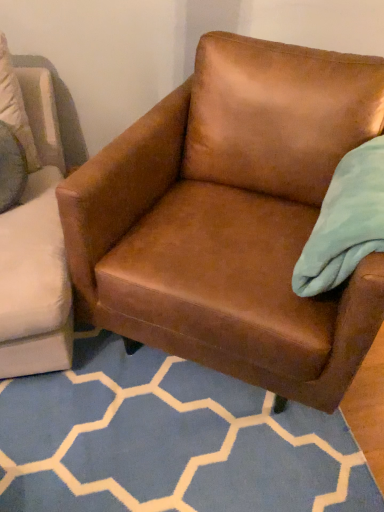
Question: Would you say brown leather chair at center is to the left or to the right of brown leather armchair at center in the picture?

Choices:
 (A) right
 (B) left

Answer: (A)

Question: Looking at the image, does brown leather chair at center seem bigger or smaller compared to brown leather armchair at center?

Choices:
 (A) big
 (B) small

Answer: (A)

Question: Considering the positions of brown leather chair at center and brown leather armchair at center in the image, is brown leather chair at center taller or shorter than brown leather armchair at center?

Choices:
 (A) short
 (B) tall

Answer: (B)

Question: Is point click(1, 455) positioned closer to the camera than point click(251, 153)?

Choices:
 (A) closer
 (B) farther

Answer: (A)

Question: Would you say brown leather armchair at center is to the left or to the right of brown leather chair at center in the picture?

Choices:
 (A) left
 (B) right

Answer: (A)

Question: Choose the correct answer: Is brown leather armchair at center inside brown leather chair at center or outside it?

Choices:
 (A) outside
 (B) inside

Answer: (B)

Question: From the image's perspective, is brown leather armchair at center positioned above or below brown leather chair at center?

Choices:
 (A) above
 (B) below

Answer: (B)